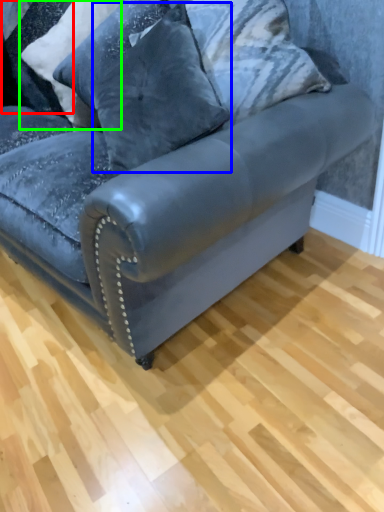
Question: Which is nearer to the pillow (highlighted by a red box)? pillow (highlighted by a blue box) or pillow (highlighted by a green box).

Choices:
 (A) pillow
 (B) pillow

Answer: (B)